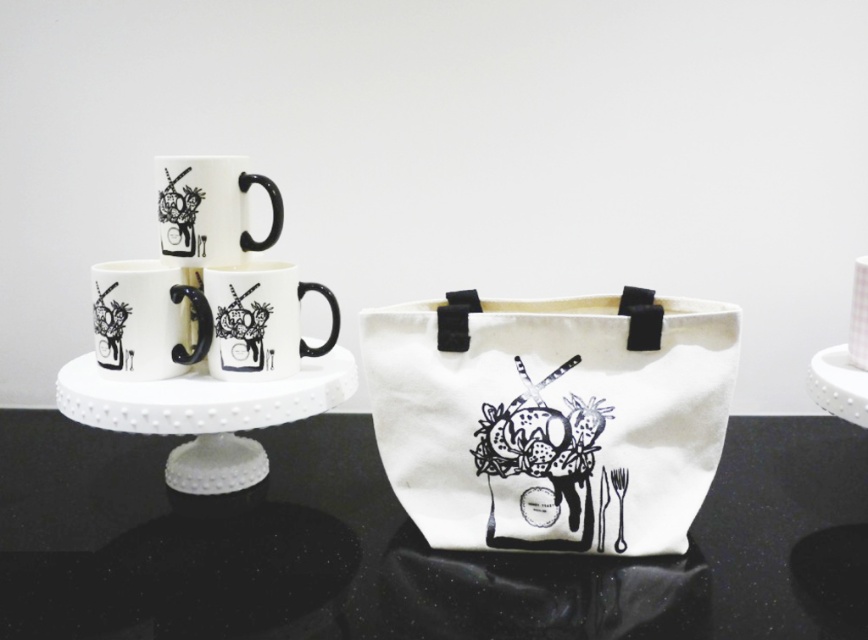
Question: Which of the following is the closest to the observer?

Choices:
 (A) white ceramic mugs at center
 (B) matte white mug at left
 (C) black glossy table at center

Answer: (C)

Question: Can you confirm if white ceramic mugs at center is positioned above white matte mug at center?

Choices:
 (A) yes
 (B) no

Answer: (B)

Question: Which point is closer to the camera taking this photo?

Choices:
 (A) (277, 353)
 (B) (271, 200)

Answer: (A)

Question: Which point appears closest to the camera in this image?

Choices:
 (A) (189, 426)
 (B) (715, 332)

Answer: (B)

Question: Is white matte mug at center thinner than white matte coffee cup at center?

Choices:
 (A) no
 (B) yes

Answer: (A)

Question: Is black glossy table at center to the right of white canvas tote at center from the viewer's perspective?

Choices:
 (A) no
 (B) yes

Answer: (A)